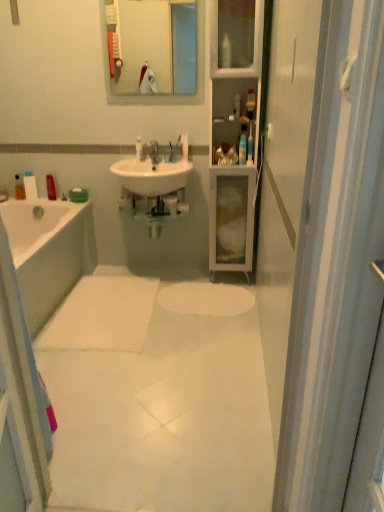
Find the location of a particular element. The width and height of the screenshot is (384, 512). vacant space to the right of white fabric shower curtain at left is located at coordinates (85, 443).